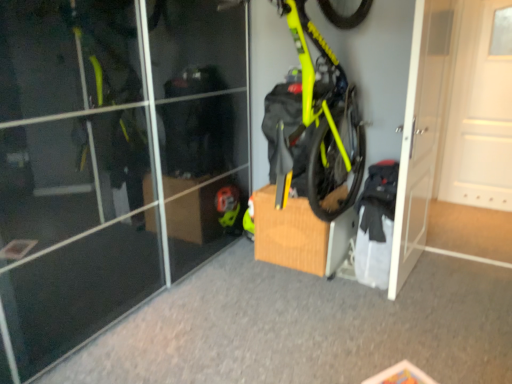
Question: Is neon yellow matte bicycle at center at the back of white matte door at right, which ranks as the 2th door in left-to-right order?

Choices:
 (A) no
 (B) yes

Answer: (A)

Question: Does white matte door at right, which ranks as the 2th door in left-to-right order, have a lesser width compared to neon yellow matte bicycle at center?

Choices:
 (A) no
 (B) yes

Answer: (B)

Question: Is white matte door at right, which appears as the first door when viewed from the right, facing towards neon yellow matte bicycle at center?

Choices:
 (A) no
 (B) yes

Answer: (A)

Question: Can neon yellow matte bicycle at center be found inside white matte door at right, which ranks as the 2th door in left-to-right order?

Choices:
 (A) no
 (B) yes

Answer: (A)

Question: Is white matte door at right, which appears as the first door when viewed from the right, to the left of neon yellow matte bicycle at center from the viewer's perspective?

Choices:
 (A) no
 (B) yes

Answer: (A)

Question: From a real-world perspective, is white matte door at right, which ranks as the 2th door in left-to-right order, physically below neon yellow matte bicycle at center?

Choices:
 (A) yes
 (B) no

Answer: (A)

Question: Considering the relative positions of white matte door at right, which ranks as the 2th door in left-to-right order, and white glossy door at center right, marked as the second door in a right-to-left arrangement, in the image provided, is white matte door at right, which ranks as the 2th door in left-to-right order, to the right of white glossy door at center right, marked as the second door in a right-to-left arrangement, from the viewer's perspective?

Choices:
 (A) yes
 (B) no

Answer: (A)

Question: Can you confirm if white matte door at right, which appears as the first door when viewed from the right, is thinner than white glossy door at center right, marked as the second door in a right-to-left arrangement?

Choices:
 (A) no
 (B) yes

Answer: (A)

Question: Considering the relative sizes of white matte door at right, which ranks as the 2th door in left-to-right order, and white glossy door at center right, positioned as the first door in left-to-right order, in the image provided, is white matte door at right, which ranks as the 2th door in left-to-right order, taller than white glossy door at center right, positioned as the first door in left-to-right order,?

Choices:
 (A) no
 (B) yes

Answer: (A)

Question: Is white matte door at right, which ranks as the 2th door in left-to-right order, oriented towards white glossy door at center right, positioned as the first door in left-to-right order?

Choices:
 (A) yes
 (B) no

Answer: (B)

Question: Considering the relative sizes of white matte door at right, which appears as the first door when viewed from the right, and white glossy door at center right, positioned as the first door in left-to-right order, in the image provided, is white matte door at right, which appears as the first door when viewed from the right, shorter than white glossy door at center right, positioned as the first door in left-to-right order,?

Choices:
 (A) no
 (B) yes

Answer: (B)

Question: Is the depth of white matte door at right, which appears as the first door when viewed from the right, greater than that of white glossy door at center right, positioned as the first door in left-to-right order?

Choices:
 (A) yes
 (B) no

Answer: (A)

Question: Would you say neon yellow matte bicycle at center is part of white glossy door at center right, marked as the second door in a right-to-left arrangement,'s contents?

Choices:
 (A) no
 (B) yes

Answer: (A)